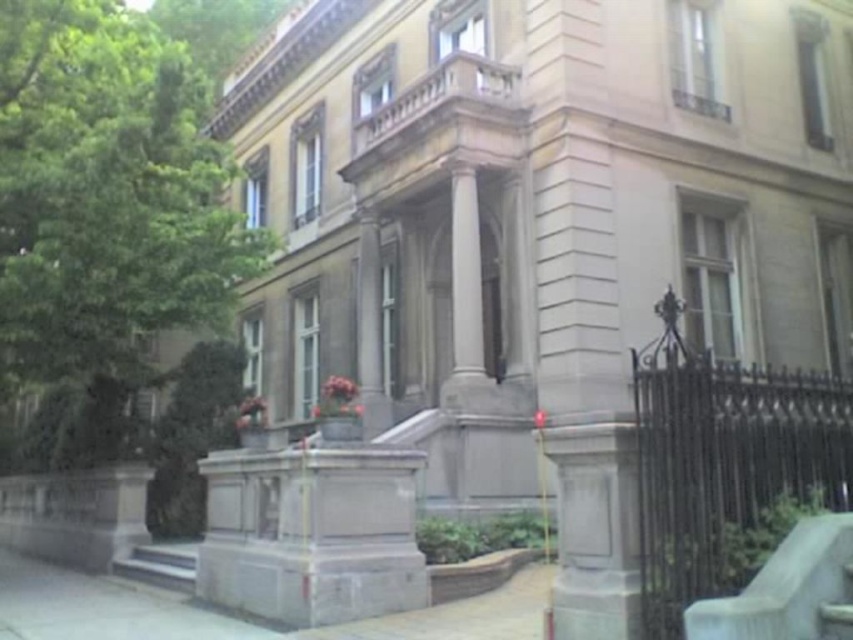
Question: Does white marble column at center appear under green leafy tree at upper left?

Choices:
 (A) no
 (B) yes

Answer: (B)

Question: Is the position of green leafy tree at left less distant than that of smooth concrete stairs at lower left?

Choices:
 (A) yes
 (B) no

Answer: (B)

Question: Which point is closer to the camera taking this photo?

Choices:
 (A) (457, 282)
 (B) (251, 36)
 (C) (206, 284)
 (D) (183, 573)

Answer: (D)

Question: Which of the following is the closest to the observer?

Choices:
 (A) (171, 0)
 (B) (467, 218)

Answer: (B)

Question: Is white marble column at center to the right of smooth concrete stairs at lower left from the viewer's perspective?

Choices:
 (A) yes
 (B) no

Answer: (A)

Question: Among these points, which one is farthest from the camera?

Choices:
 (A) (230, 288)
 (B) (222, 67)
 (C) (194, 552)
 (D) (457, 282)

Answer: (B)